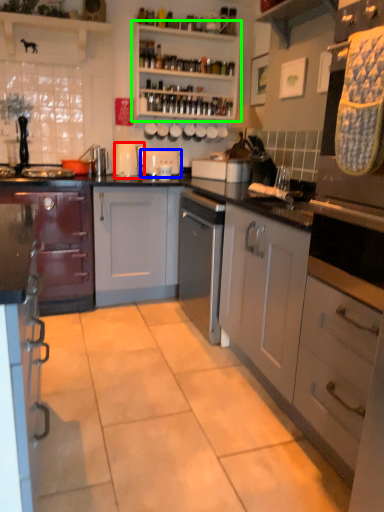
Question: Based on their relative distances, which object is nearer to kitchen appliance (highlighted by a red box)? Choose from appliance (highlighted by a blue box) and shelf (highlighted by a green box).

Choices:
 (A) appliance
 (B) shelf

Answer: (A)